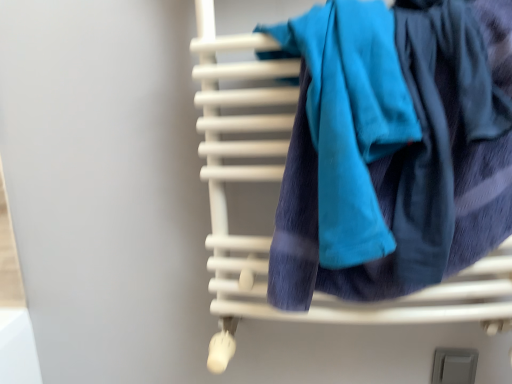
What do you see at coordinates (454, 366) in the screenshot?
I see `gray matte switch at lower right` at bounding box center [454, 366].

What is the approximate height of white matte towel rack at center?

white matte towel rack at center is 78.32 centimeters tall.

The width and height of the screenshot is (512, 384). I want to click on white matte towel rack at center, so [306, 234].

What is the approximate width of teal soft towel at center?

teal soft towel at center is 7.10 inches wide.

Locate an element on the screen. Image resolution: width=512 pixels, height=384 pixels. gray matte switch at lower right is located at coordinates (454, 366).

What's the angular difference between white matte towel rack at center and gray matte switch at lower right's facing directions?

0.333 degrees separate the facing orientations of white matte towel rack at center and gray matte switch at lower right.

Based on the photo, considering the sizes of objects white matte towel rack at center and gray matte switch at lower right in the image provided, who is wider, white matte towel rack at center or gray matte switch at lower right?

Wider between the two is white matte towel rack at center.

From the image's perspective, is white matte towel rack at center above gray matte switch at lower right?

Indeed, from the image's perspective, white matte towel rack at center is shown above gray matte switch at lower right.

Is white matte towel rack at center oriented towards gray matte switch at lower right?

No, white matte towel rack at center is not oriented towards gray matte switch at lower right.

From a real-world perspective, between teal soft towel at center and gray matte switch at lower right, who is vertically lower?

gray matte switch at lower right is physically lower.

Is teal soft towel at center oriented towards gray matte switch at lower right?

No, teal soft towel at center does not turn towards gray matte switch at lower right.

From the image's perspective, is teal soft towel at center under gray matte switch at lower right?

No.

This screenshot has width=512, height=384. Identify the location of bath towel lying in front of the gray matte switch at lower right. (350, 118).

From the picture: Is gray matte switch at lower right aimed at teal soft towel at center?

No.

Considering the sizes of gray matte switch at lower right and teal soft towel at center in the image, is gray matte switch at lower right bigger or smaller than teal soft towel at center?

Clearly, gray matte switch at lower right is smaller in size than teal soft towel at center.

From the image's perspective, which one is positioned higher, gray matte switch at lower right or teal soft towel at center?

teal soft towel at center, from the image's perspective.

Can you confirm if gray matte switch at lower right is wider than white matte towel rack at center?

In fact, gray matte switch at lower right might be narrower than white matte towel rack at center.

Measure the distance from gray matte switch at lower right to white matte towel rack at center.

gray matte switch at lower right is 16.42 inches away from white matte towel rack at center.

At what (x,y) coordinates should I click in order to perform the action: click on window behind the white matte towel rack at center. Please return your answer as a coordinate pair (x, y). The width and height of the screenshot is (512, 384). Looking at the image, I should click on (454, 366).

From a real-world perspective, is gray matte switch at lower right positioned above or below white matte towel rack at center?

From a real-world perspective, gray matte switch at lower right is physically below white matte towel rack at center.

Is white matte towel rack at center not inside teal soft towel at center?

Yes.

Considering the sizes of white matte towel rack at center and teal soft towel at center in the image, is white matte towel rack at center bigger or smaller than teal soft towel at center?

Considering their sizes, white matte towel rack at center takes up more space than teal soft towel at center.

From the image's perspective, which is above, white matte towel rack at center or teal soft towel at center?

From the image's view, teal soft towel at center is above.

The width and height of the screenshot is (512, 384). Find the location of `furniture below the teal soft towel at center (from a real-world perspective)`. furniture below the teal soft towel at center (from a real-world perspective) is located at coordinates (306, 234).

Between point (325, 219) and point (219, 220), which one is positioned behind?

The point (219, 220) is more distant.

From a real-world perspective, is teal soft towel at center over white matte towel rack at center?

Indeed, from a real-world perspective, teal soft towel at center stands above white matte towel rack at center.

Looking at their sizes, would you say teal soft towel at center is wider or thinner than white matte towel rack at center?

teal soft towel at center is thinner than white matte towel rack at center.

The image size is (512, 384). Find the location of `furniture located in front of the gray matte switch at lower right`. furniture located in front of the gray matte switch at lower right is located at coordinates (306, 234).

What are the coordinates of `bath towel lying on the left of gray matte switch at lower right` in the screenshot? It's located at (350, 118).

Estimate the real-world distances between objects in this image. Which object is further from teal soft towel at center, white matte towel rack at center or gray matte switch at lower right?

Among the two, gray matte switch at lower right is located further to teal soft towel at center.

Estimate the real-world distances between objects in this image. Which object is further from white matte towel rack at center, teal soft towel at center or gray matte switch at lower right?

gray matte switch at lower right is positioned further to the anchor white matte towel rack at center.

Considering their positions, is teal soft towel at center positioned closer to gray matte switch at lower right than white matte towel rack at center?

The object closer to gray matte switch at lower right is white matte towel rack at center.

From the image, which object appears to be nearer to teal soft towel at center, gray matte switch at lower right or white matte towel rack at center?

Among the two, white matte towel rack at center is located nearer to teal soft towel at center.

Looking at the image, which one is located closer to gray matte switch at lower right, white matte towel rack at center or teal soft towel at center?

white matte towel rack at center is positioned closer to the anchor gray matte switch at lower right.

From the image, which object appears to be nearer to white matte towel rack at center, gray matte switch at lower right or teal soft towel at center?

teal soft towel at center is closer to white matte towel rack at center.

Where is `furniture between teal soft towel at center and gray matte switch at lower right in the up-down direction`? furniture between teal soft towel at center and gray matte switch at lower right in the up-down direction is located at coordinates (306, 234).